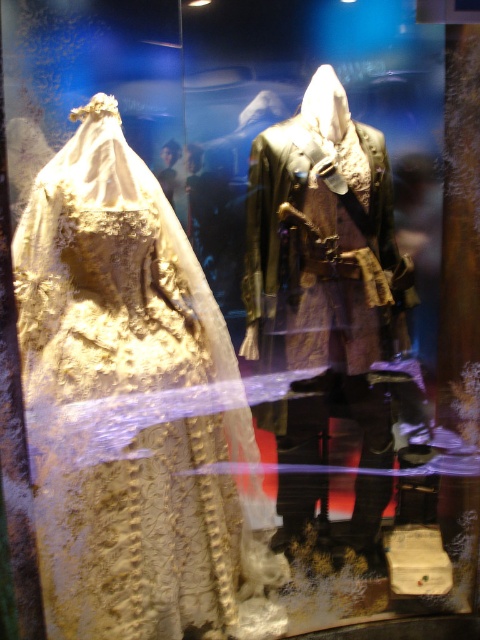
You are a museum security guard and need to check the height of the white lace dress at left and the shiny brown leather coat at center. According to the description, which object is positioned lower in the display?

The white lace dress at left is positioned below the shiny brown leather coat at center, so the white lace dress at left is lower in the display.

You are a photographer trying to capture the two points in the glass case display. Which point, point [120,412] or point [373,164], is closer to your camera lens?

Point [120,412] is closer to the camera lens than point [373,164].